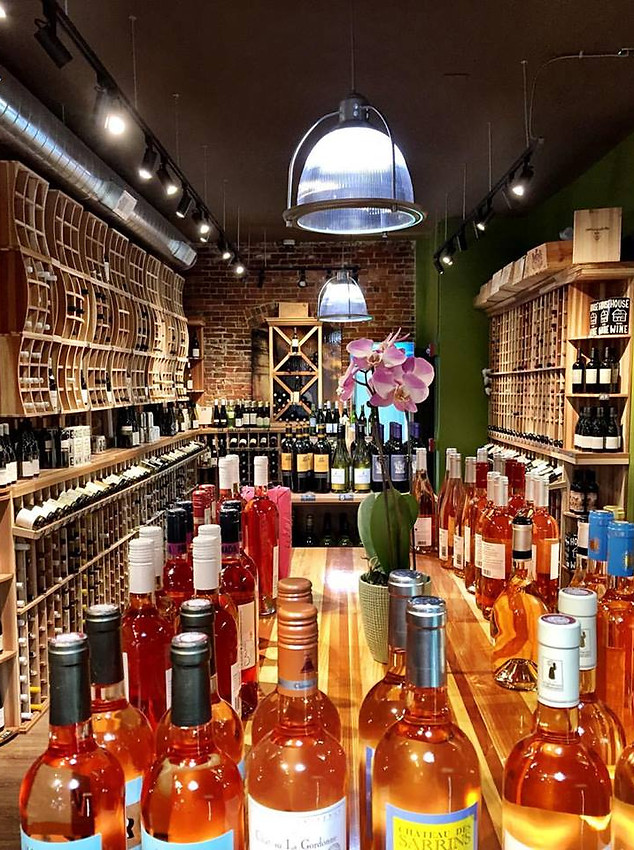
Locate an element on the screen. green ceramic planter with basket pattern is located at coordinates (378, 604).